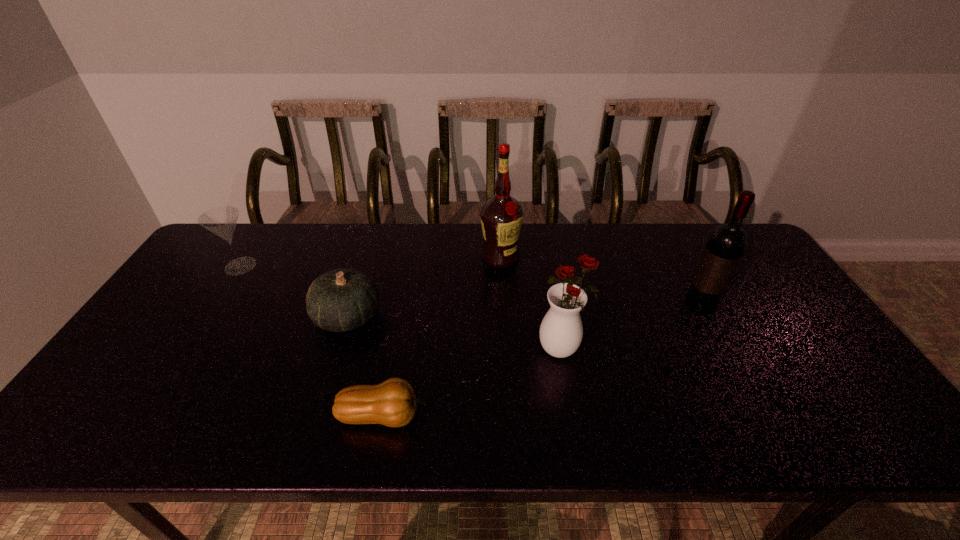
You are a GUI agent. You are given a task and a screenshot of the screen. Output one action in this format:
    pyautogui.click(x=<x>, y=<y>)
    Task: Click on the free space between the fifth object from left to right and the third shortest object
    
    Given the screenshot: What is the action you would take?
    pyautogui.click(x=401, y=307)

In order to click on empty location between the wine bottle and the vase in this screenshot , I will do `click(631, 328)`.

Where is `free space between the fourth shortest object and the nearer gourd`? free space between the fourth shortest object and the nearer gourd is located at coordinates coord(473,382).

Where is `vacant point located between the nearest object and the second shortest object`? This screenshot has height=540, width=960. vacant point located between the nearest object and the second shortest object is located at coordinates (366, 366).

Locate which object ranks in proximity to the leftmost object. Please provide its 2D coordinates. Your answer should be formatted as a tuple, i.e. [(x, y)], where the tuple contains the x and y coordinates of a point satisfying the conditions above.

[(343, 299)]

Where is `object that is the third closest one to the third object from right to left`? This screenshot has width=960, height=540. object that is the third closest one to the third object from right to left is located at coordinates (726, 244).

Where is `vacant region that satisfies the following two spatial constraints: 1. on the label of the alcohol; 2. on the right side of the rightmost object`? vacant region that satisfies the following two spatial constraints: 1. on the label of the alcohol; 2. on the right side of the rightmost object is located at coordinates click(x=503, y=306).